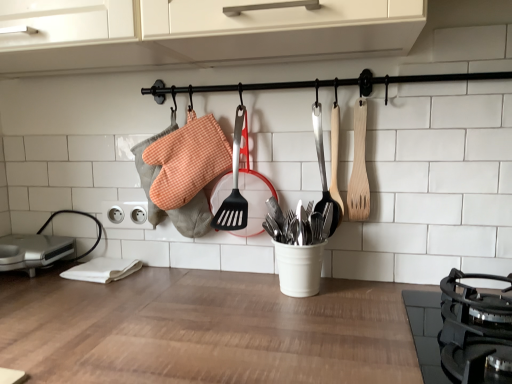
Question: Which is correct: wooden spatula at right, the 1th spatula when ordered from right to left, is inside wooden spatula at center, the 2th spatula viewed from the right, or outside of it?

Choices:
 (A) inside
 (B) outside

Answer: (B)

Question: In terms of size, does wooden spatula at right, which appears as the 2th spatula when viewed from the left, appear bigger or smaller than wooden spatula at center, the 2th spatula viewed from the right?

Choices:
 (A) small
 (B) big

Answer: (A)

Question: Which object is positioned farthest from the wooden spatula at center, which appears as the first spatula when viewed from the left?

Choices:
 (A) white plastic electrical outlet at lower left
 (B) silver metallic sandwich maker at lower left
 (C) black matte gas stove at lower right
 (D) wooden spatula at right, the 1th spatula when ordered from right to left
 (E) orange checkered fabric oven mitts at center

Answer: (B)

Question: Considering the real-world distances, which object is farthest from the wooden spatula at right, the 1th spatula when ordered from right to left?

Choices:
 (A) orange checkered fabric oven mitts at center
 (B) black matte gas stove at lower right
 (C) silver metallic sandwich maker at lower left
 (D) wooden spatula at center, which appears as the first spatula when viewed from the left
 (E) white plastic electrical outlet at lower left

Answer: (C)